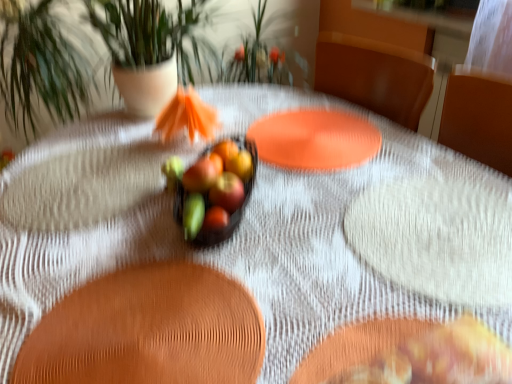
Locate an element on the screen. free space to the left of green matte apple at center, the third fruit positioned from the right is located at coordinates (110, 193).